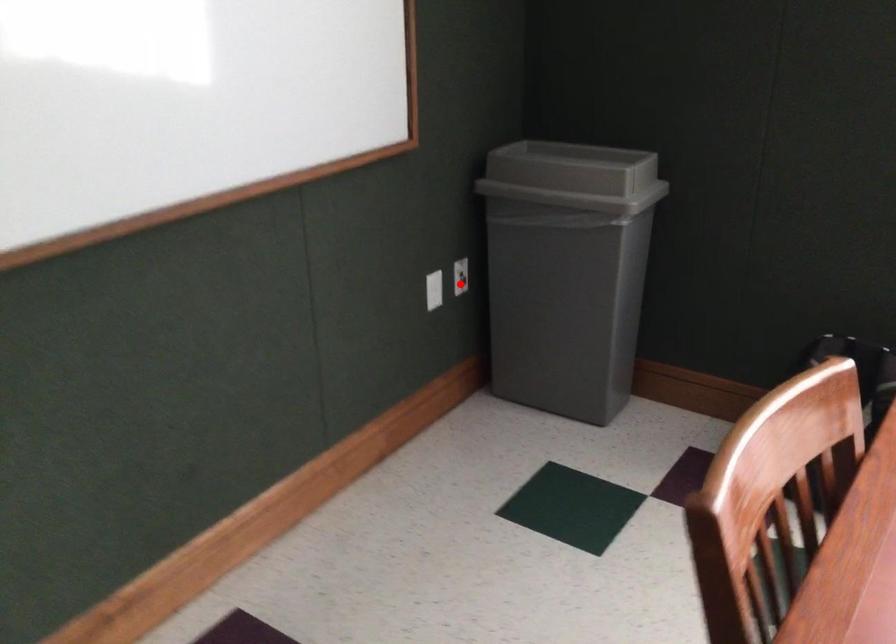
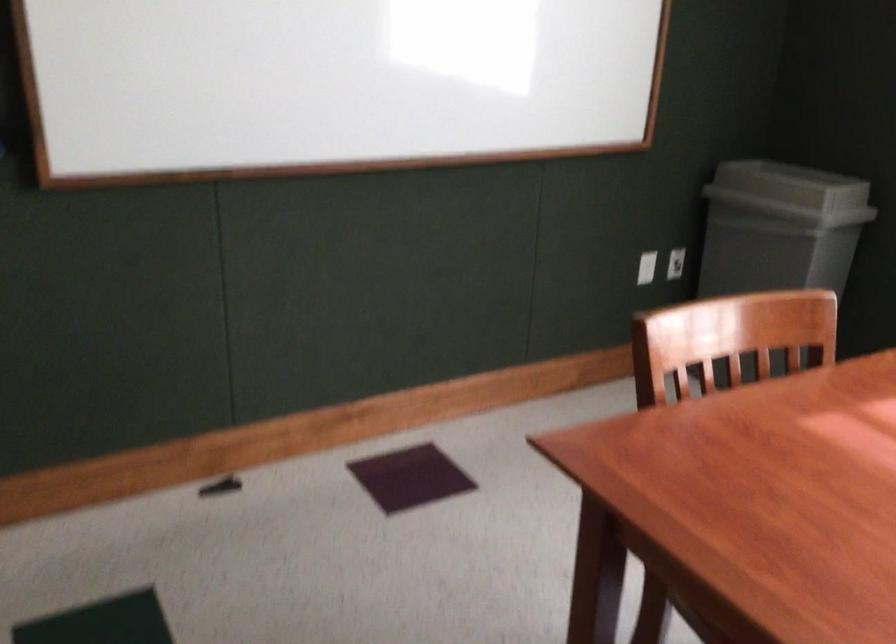
Question: I am providing you with two images of the same scene from different viewpoints. A red point is shown in image1. For the corresponding object point in image2, is it positioned nearer or farther from the camera?

Choices:
 (A) Nearer
 (B) Farther

Answer: (B)